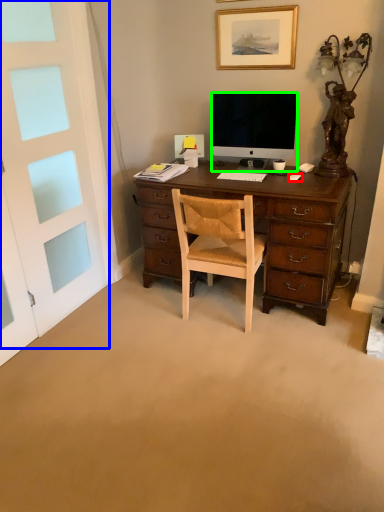
Question: Estimate the real-world distances between objects in this image. Which object is closer to computer mouse (highlighted by a red box), screen door (highlighted by a blue box) or television (highlighted by a green box)?

Choices:
 (A) screen door
 (B) television

Answer: (B)